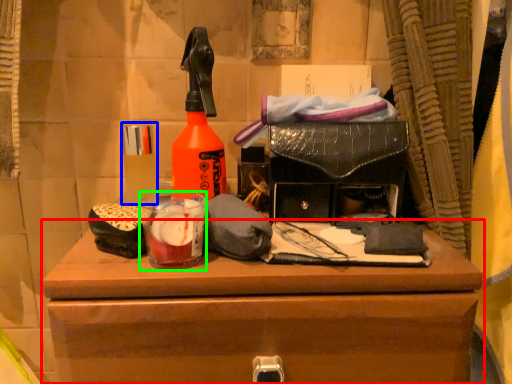
Question: Which object is the closest to the chest of drawers (highlighted by a red box)? Choose among these: toiletry (highlighted by a blue box) or beverage (highlighted by a green box).

Choices:
 (A) toiletry
 (B) beverage

Answer: (B)